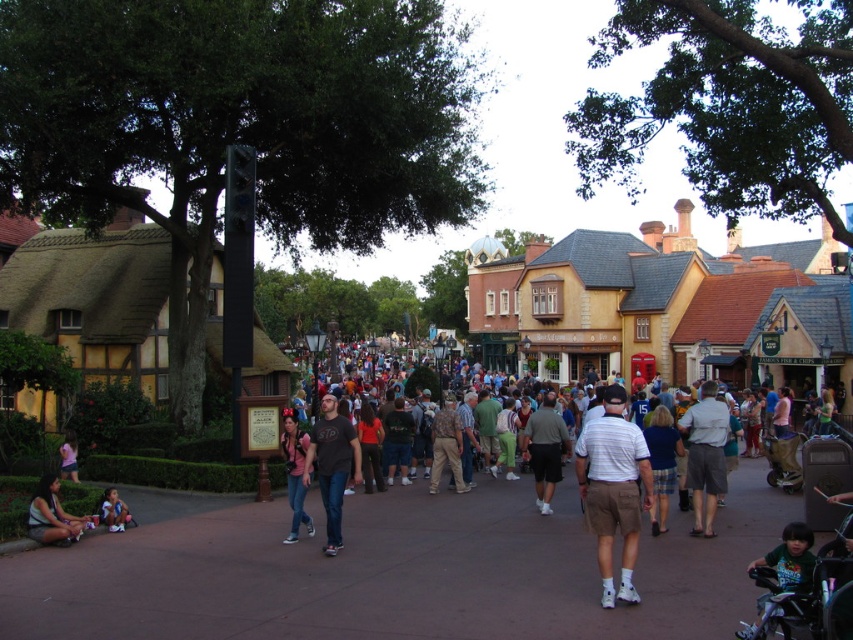
Question: Is dark gray t-shirt at center thinner than matte blue shorts at lower left?

Choices:
 (A) no
 (B) yes

Answer: (A)

Question: Which object is the farthest from the light brown shorts at center?

Choices:
 (A) matte blue shorts at lower left
 (B) dark green shirt at lower right

Answer: (A)

Question: Can you confirm if striped cotton shirt at center is positioned above light brown shorts at center?

Choices:
 (A) yes
 (B) no

Answer: (A)

Question: Which point is farther to the camera?

Choices:
 (A) dark gray t-shirt at center
 (B) matte black shorts at lower left
 (C) denim jeans at center
 (D) matte blue shorts at lower left

Answer: (C)

Question: Based on their relative distances, which object is farther from the light brown shorts at center?

Choices:
 (A) denim jeans at center
 (B) brown concrete pavement at center

Answer: (A)

Question: In this image, where is brown concrete pavement at center located relative to dark gray t-shirt at center?

Choices:
 (A) above
 (B) below

Answer: (B)